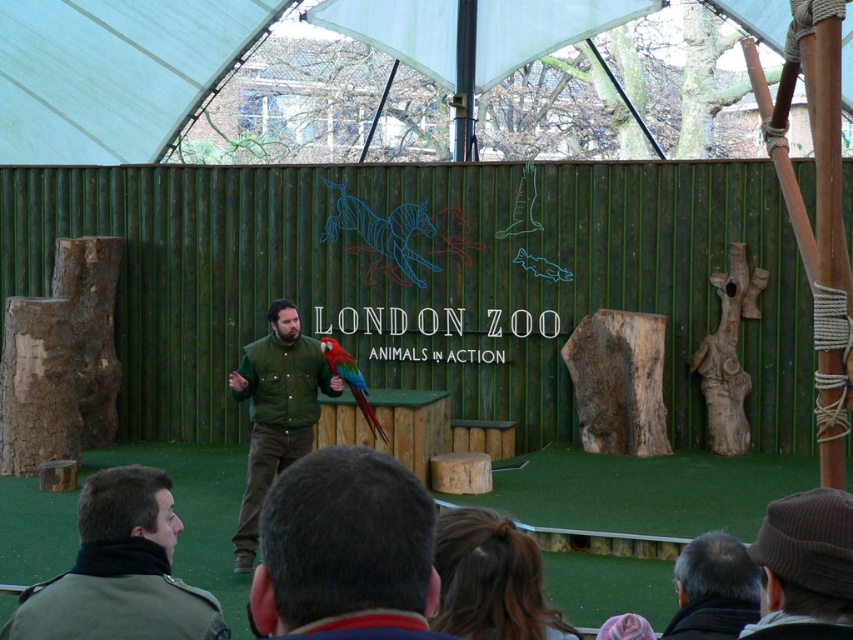
What are the coordinates of the white fabric canopy at upper center?

The white fabric canopy at upper center is located at point (x=113, y=72).

You are a visitor at the London Zoo presentation. You see the green matte jacket at lower left and the shiny multicolored parrot at center. Which object is positioned lower in the image?

The green matte jacket at lower left is positioned below the shiny multicolored parrot at center, so it is lower in the image.

You are a photographer at London Zoo. You want to take a photo of the gray hair at lower right and the shiny multicolored parrot at center. Which object should you focus on first if you want to capture both in focus without adjusting the camera settings?

The gray hair at lower right has a lesser height compared to the shiny multicolored parrot at center, so you should focus on the shiny multicolored parrot at center first since it is taller and will be in focus if the gray hair at lower right is also within the depth of field.